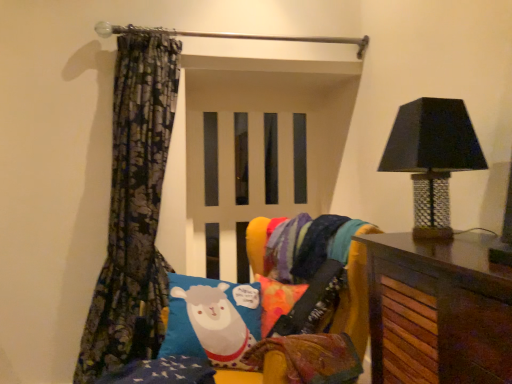
Question: Could you tell me if velvet multicolored bean bag chair at center is facing black mosaic table lamp at right?

Choices:
 (A) no
 (B) yes

Answer: (A)

Question: Considering the relative positions of velvet multicolored bean bag chair at center and black mosaic table lamp at right in the image provided, is velvet multicolored bean bag chair at center to the right of black mosaic table lamp at right from the viewer's perspective?

Choices:
 (A) yes
 (B) no

Answer: (B)

Question: Is velvet multicolored bean bag chair at center next to black mosaic table lamp at right?

Choices:
 (A) yes
 (B) no

Answer: (B)

Question: Is the position of velvet multicolored bean bag chair at center more distant than that of black mosaic table lamp at right?

Choices:
 (A) yes
 (B) no

Answer: (A)

Question: Is velvet multicolored bean bag chair at center taller than black mosaic table lamp at right?

Choices:
 (A) no
 (B) yes

Answer: (A)

Question: Does velvet multicolored bean bag chair at center appear on the left side of black mosaic table lamp at right?

Choices:
 (A) yes
 (B) no

Answer: (A)

Question: From a real-world perspective, is velvet multicolored bean bag chair at center located higher than blue fabric pillow with sheep design at center?

Choices:
 (A) yes
 (B) no

Answer: (A)

Question: Is velvet multicolored bean bag chair at center bigger than blue fabric pillow with sheep design at center?

Choices:
 (A) no
 (B) yes

Answer: (A)

Question: Is velvet multicolored bean bag chair at center oriented away from blue fabric pillow with sheep design at center?

Choices:
 (A) no
 (B) yes

Answer: (B)

Question: Does velvet multicolored bean bag chair at center appear on the right side of blue fabric pillow with sheep design at center?

Choices:
 (A) yes
 (B) no

Answer: (A)

Question: Is velvet multicolored bean bag chair at center oriented towards blue fabric pillow with sheep design at center?

Choices:
 (A) yes
 (B) no

Answer: (A)

Question: Is velvet multicolored bean bag chair at center taller than blue fabric pillow with sheep design at center?

Choices:
 (A) yes
 (B) no

Answer: (B)

Question: From a real-world perspective, is floral-patterned fabric at left below black mosaic table lamp at right?

Choices:
 (A) no
 (B) yes

Answer: (B)